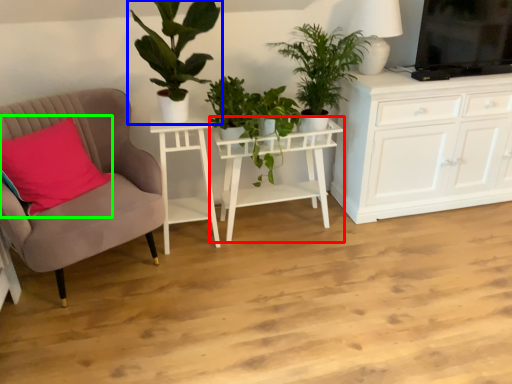
Question: Which object is the closest to the table (highlighted by a red box)? Choose among these: houseplant (highlighted by a blue box) or pillow (highlighted by a green box).

Choices:
 (A) houseplant
 (B) pillow

Answer: (A)